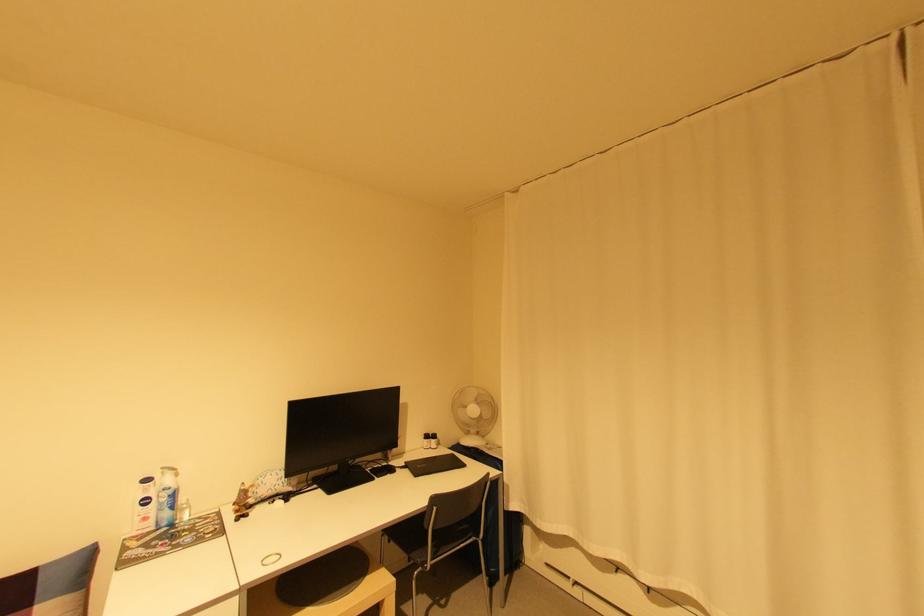
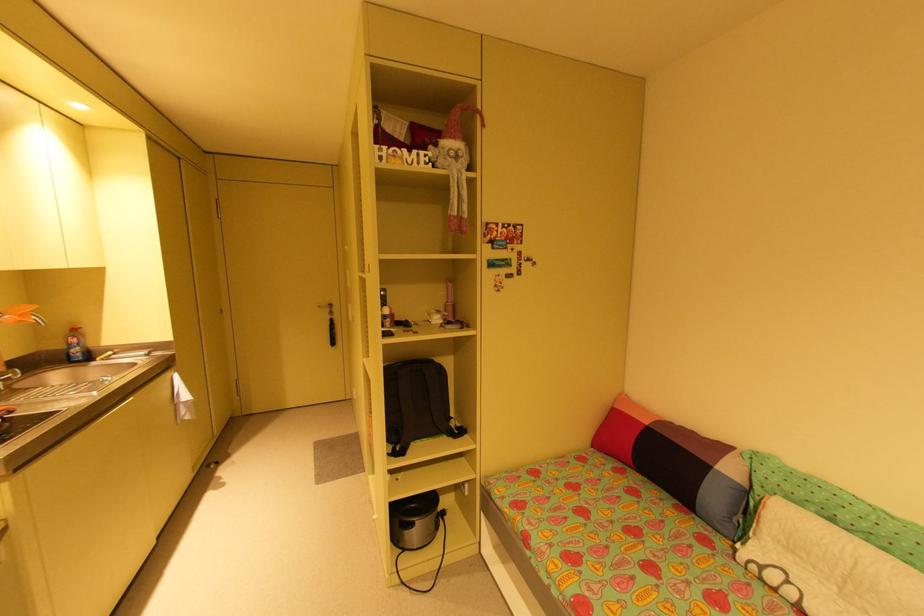
Question: The first image is from the beginning of the video and the second image is from the end. How did the camera likely rotate when shooting the video?

Choices:
 (A) Left
 (B) Right
 (C) Up
 (D) Down

Answer: (A)